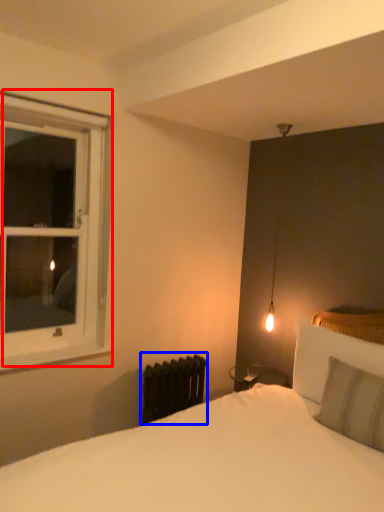
Question: Which object appears farthest to the camera in this image, window (highlighted by a red box) or radiator (highlighted by a blue box)?

Choices:
 (A) window
 (B) radiator

Answer: (B)